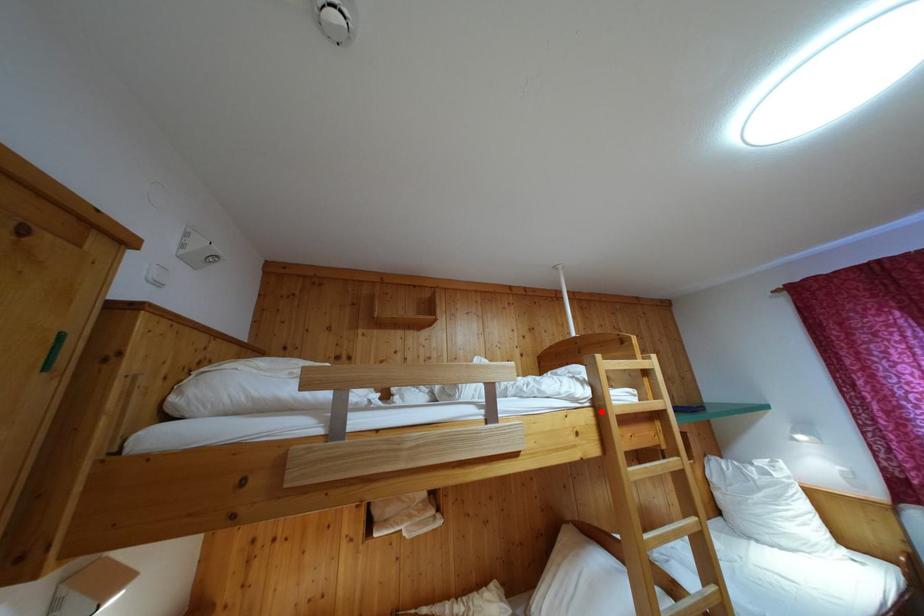
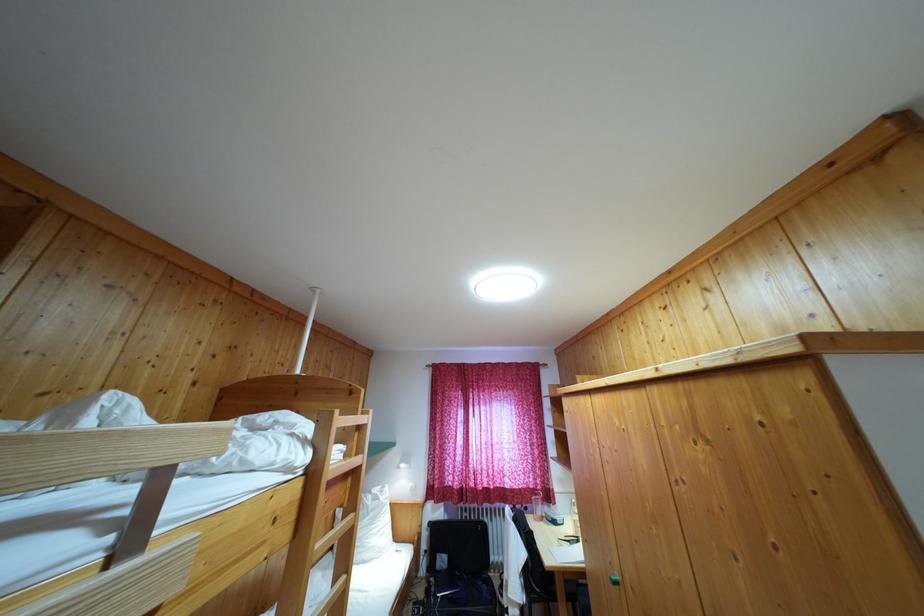
In the second image, find the point that corresponds to the highlighted location in the first image.

(317, 479)